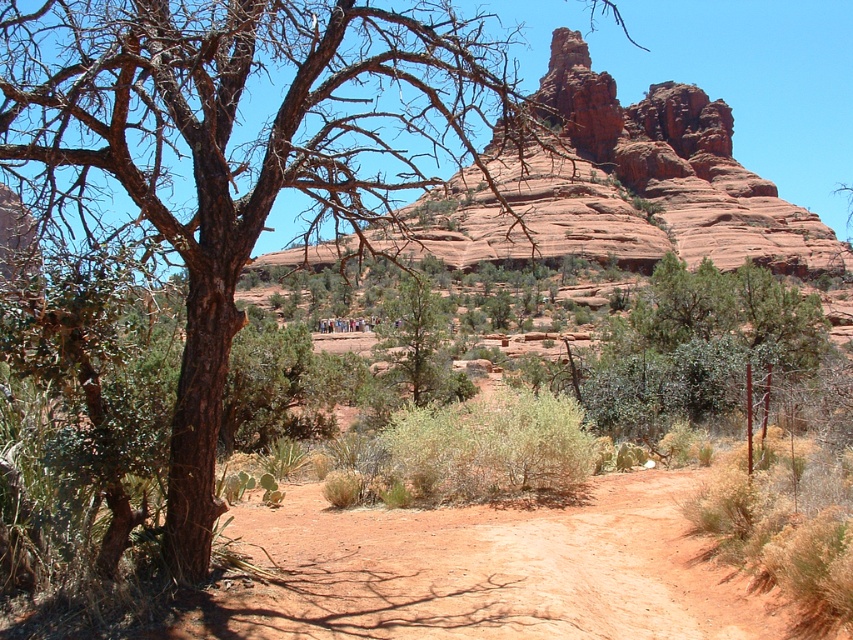
Is point (73, 124) in front of point (397, 300)?

No.

Who is positioned more to the right, brown rough bark tree at left or green textured tree at center?

Positioned to the right is green textured tree at center.

Is point (149, 61) farther from camera compared to point (428, 301)?

No, it is not.

Locate an element on the screen. Image resolution: width=853 pixels, height=640 pixels. brown rough bark tree at left is located at coordinates (242, 148).

Which is above, dusty reddish-brown dirt track at center or green textured tree at center?

green textured tree at center is higher up.

Does point (511, 538) come behind point (413, 355)?

No, (511, 538) is in front of (413, 355).

I want to click on dusty reddish-brown dirt track at center, so click(490, 570).

Between brown rough bark tree at left and dusty reddish-brown dirt track at center, which one appears on the right side from the viewer's perspective?

From the viewer's perspective, dusty reddish-brown dirt track at center appears more on the right side.

Who is more forward, (x=74, y=81) or (x=396, y=515)?

Point (x=74, y=81) is in front.

Identify the location of brown rough bark tree at left. (242, 148).